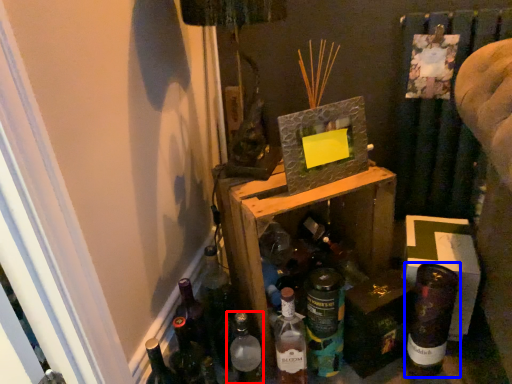
Question: Which point is closer to the camera, bottle (highlighted by a red box) or bottle (highlighted by a blue box)?

Choices:
 (A) bottle
 (B) bottle

Answer: (A)